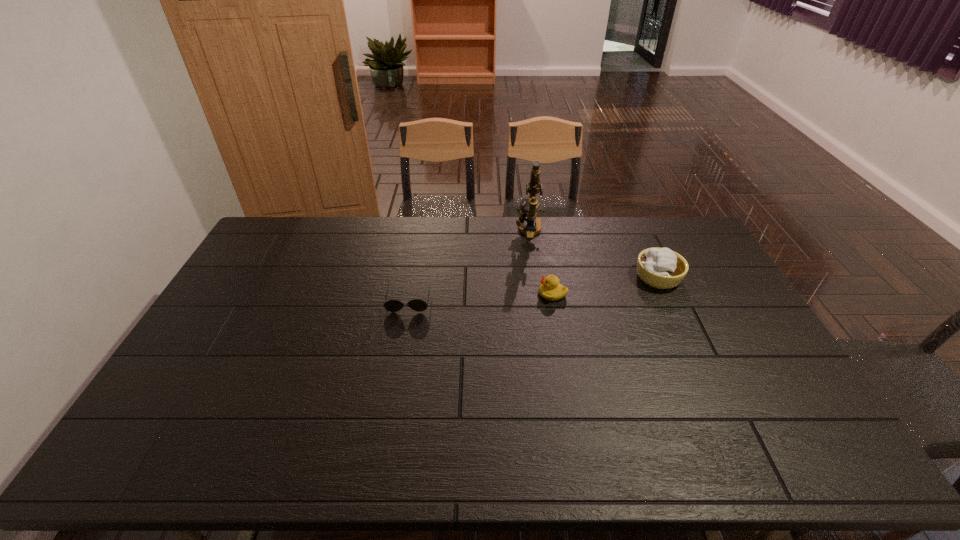
The width and height of the screenshot is (960, 540). What are the coordinates of `the farthest object` in the screenshot? It's located at (531, 205).

You are a GUI agent. You are given a task and a screenshot of the screen. Output one action in this format:
    pyautogui.click(x=<x>, y=<y>)
    Task: Click on the tallest object
    
    Given the screenshot: What is the action you would take?
    pyautogui.click(x=531, y=205)

Locate an element on the screen. the second tallest object is located at coordinates (662, 268).

Locate an element on the screen. This screenshot has height=540, width=960. whipped cream is located at coordinates (662, 268).

The image size is (960, 540). Find the location of `duckling`. duckling is located at coordinates (550, 289).

Find the location of `sunglasses`. sunglasses is located at coordinates (418, 305).

Locate an element on the screen. the shortest object is located at coordinates (418, 305).

The image size is (960, 540). I want to click on free space located on the right of the microscope, so click(x=571, y=231).

Locate an element on the screen. The image size is (960, 540). free space located on the back of the rightmost object is located at coordinates (633, 222).

I want to click on blank space located 0.110m on the front-facing side of the duckling, so click(505, 294).